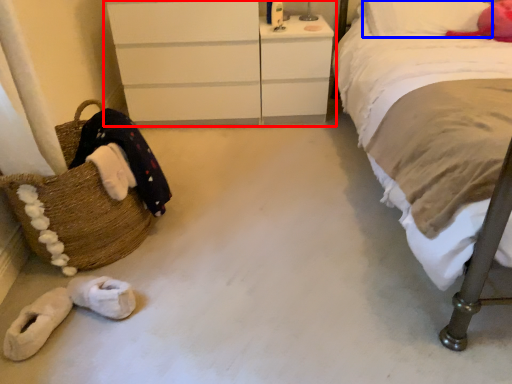
Question: Which object is closer to the camera taking this photo, chest of drawers (highlighted by a red box) or pillow (highlighted by a blue box)?

Choices:
 (A) chest of drawers
 (B) pillow

Answer: (B)